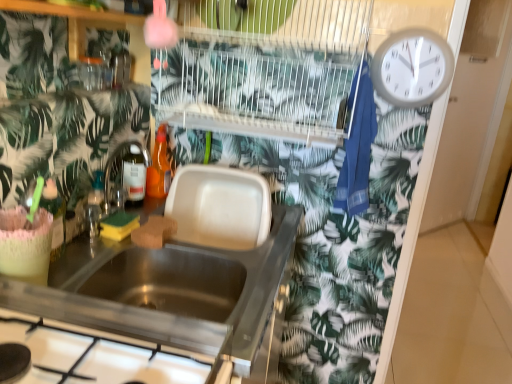
Image resolution: width=512 pixels, height=384 pixels. What are the coordinates of `free space in front of green sponge at sink, positioned as the first food in left-to-right order` in the screenshot? It's located at (93, 254).